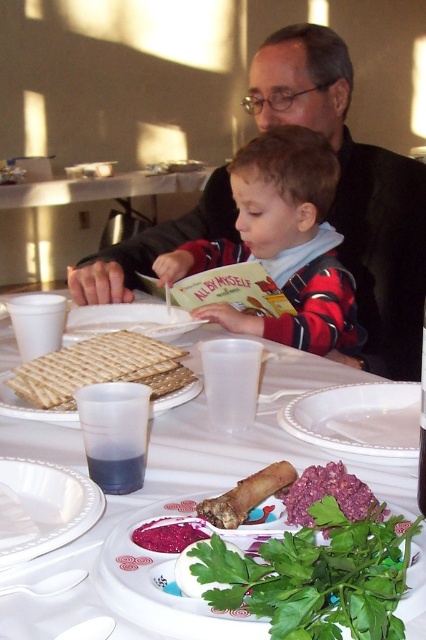
Question: Among these objects, which one is farthest from the camera?

Choices:
 (A) red plaid sweater at center
 (B) purple crumbly spread at center
 (C) green leafy parsley at lower center
 (D) matte white plate at center

Answer: (A)

Question: Is green leafy parsley at lower center to the left of golden crisp matzah at left from the viewer's perspective?

Choices:
 (A) no
 (B) yes

Answer: (A)

Question: Based on their relative distances, which object is farther from the matte white plate at center?

Choices:
 (A) white ceramic plate at lower left
 (B) matte brown matzah at center
 (C) golden crisp matzah at left

Answer: (B)

Question: Which object is the farthest from the golden crisp matzah at left?

Choices:
 (A) brown crispy pastry at center
 (B) green leafy parsley at lower center
 (C) purple mashed potatoes at center
 (D) red plaid sweater at center

Answer: (D)

Question: Is white porcelain plate at center smaller than matte white plate at center?

Choices:
 (A) yes
 (B) no

Answer: (B)

Question: Does white paper plate at center lie behind purple mashed potatoes at center?

Choices:
 (A) yes
 (B) no

Answer: (B)